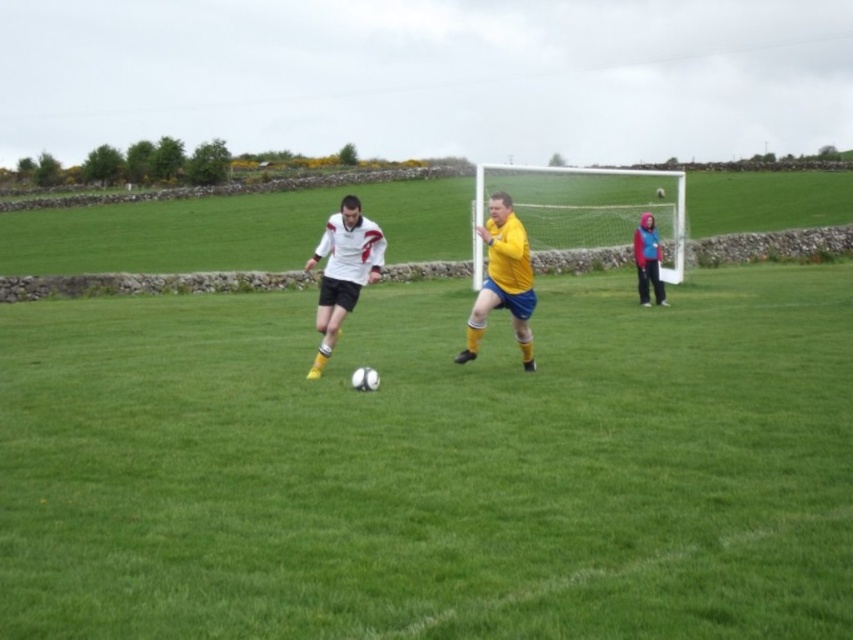
Question: Estimate the real-world distances between objects in this image. Which object is closer to the white matte jersey at center?

Choices:
 (A) blue fleece jacket at upper right
 (B) yellow matte jersey at center
 (C) white mesh net at center

Answer: (B)

Question: Does white matte soccer ball at center appear under blue fleece jacket at upper right?

Choices:
 (A) yes
 (B) no

Answer: (A)

Question: Is yellow matte jersey at center wider than blue fleece jacket at upper right?

Choices:
 (A) no
 (B) yes

Answer: (B)

Question: Among these objects, which one is farthest from the camera?

Choices:
 (A) yellow matte jersey at center
 (B) white matte jersey at center
 (C) blue fleece jacket at upper right

Answer: (C)

Question: Is white matte soccer ball at center to the right of white mesh net at center from the viewer's perspective?

Choices:
 (A) yes
 (B) no

Answer: (B)

Question: Which of the following is the closest to the observer?

Choices:
 (A) (641, 288)
 (B) (671, 232)
 (C) (849, 378)

Answer: (C)